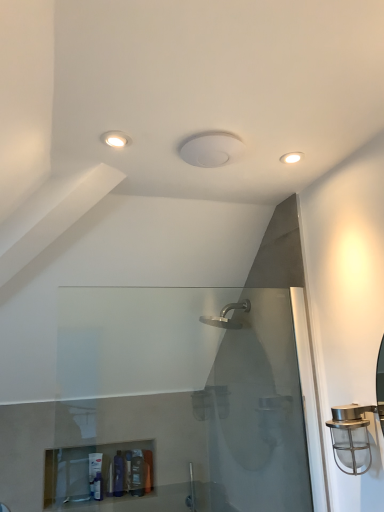
Question: From a real-world perspective, is matte white recessed light at upper left, the first light fixture when ordered from left to right, physically below translucent plastic bottle at lower left, the third toiletry in the right-to-left sequence?

Choices:
 (A) yes
 (B) no

Answer: (B)

Question: Is matte white recessed light at upper left, the first light fixture when ordered from left to right, outside translucent plastic bottle at lower left, the 1th toiletry when ordered from left to right?

Choices:
 (A) yes
 (B) no

Answer: (A)

Question: From the image's perspective, is matte white recessed light at upper left, which is the 2th light fixture in back-to-front order, on translucent plastic bottle at lower left, the 1th toiletry when ordered from left to right?

Choices:
 (A) no
 (B) yes

Answer: (B)

Question: Can you confirm if matte white recessed light at upper left, which ranks as the first light fixture in front-to-back order, is bigger than translucent plastic bottle at lower left, the third toiletry in the right-to-left sequence?

Choices:
 (A) no
 (B) yes

Answer: (A)

Question: Is matte white recessed light at upper left, which ranks as the first light fixture in front-to-back order, to the left of translucent plastic bottle at lower left, the 1th toiletry when ordered from left to right, from the viewer's perspective?

Choices:
 (A) no
 (B) yes

Answer: (A)

Question: Is matte white recessed light at upper left, the first light fixture when ordered from left to right, smaller than translucent plastic bottle at lower left, the third toiletry in the right-to-left sequence?

Choices:
 (A) no
 (B) yes

Answer: (B)

Question: Is white matte light fixture at upper right, placed as the first light fixture when sorted from right to left, facing towards translucent plastic bottle at lower left, the third toiletry in the right-to-left sequence?

Choices:
 (A) no
 (B) yes

Answer: (A)

Question: Are white matte light fixture at upper right, which is the 1th light fixture in back-to-front order, and translucent plastic bottle at lower left, the third toiletry in the right-to-left sequence, beside each other?

Choices:
 (A) no
 (B) yes

Answer: (A)

Question: Can you confirm if white matte light fixture at upper right, which appears as the 2th light fixture when viewed from the left, is wider than translucent plastic bottle at lower left, the 1th toiletry when ordered from left to right?

Choices:
 (A) yes
 (B) no

Answer: (A)

Question: Are white matte light fixture at upper right, arranged as the 2th light fixture when viewed from the front, and translucent plastic bottle at lower left, the 1th toiletry when ordered from left to right, far apart?

Choices:
 (A) yes
 (B) no

Answer: (A)

Question: Is white matte light fixture at upper right, placed as the first light fixture when sorted from right to left, outside of translucent plastic bottle at lower left, the 1th toiletry when ordered from left to right?

Choices:
 (A) no
 (B) yes

Answer: (B)

Question: Considering the relative positions of white matte light fixture at upper right, arranged as the 2th light fixture when viewed from the front, and translucent plastic bottle at lower left, the third toiletry in the right-to-left sequence, in the image provided, is white matte light fixture at upper right, arranged as the 2th light fixture when viewed from the front, in front of translucent plastic bottle at lower left, the third toiletry in the right-to-left sequence,?

Choices:
 (A) no
 (B) yes

Answer: (B)

Question: From a real-world perspective, is translucent plastic bottle at lower center, the first toiletry from the right, located higher than white matte light fixture at upper right, which appears as the 2th light fixture when viewed from the left?

Choices:
 (A) no
 (B) yes

Answer: (A)